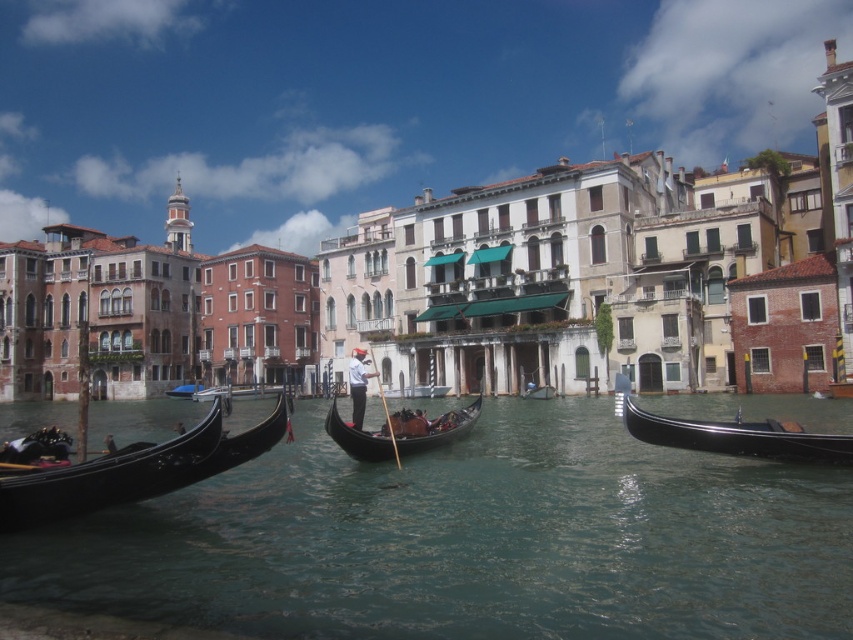
You are standing on the canal bridge and want to take a photo of the shiny black gondola at right. The camera you have can focus on objects within 100 feet. Will the gondola be in focus?

The shiny black gondola at right is 138.74 feet away from the camera, which is beyond the 100 feet focus range. Therefore, the gondola will not be in focus.

You are a tourist planning to take a gondola ride in Venice. You want to choose the widest gondola available for a more spacious experience. Based on the scene, which gondola between the black polished wood gondola at left and the wooden gondola at center should you choose?

The black polished wood gondola at left might be wider than wooden gondola at center, so it could be the better choice for a wider gondola.

You are standing on a bridge overlooking the canal and see the clear water at center and the blue fabric boat at center. Which one appears higher from your viewpoint?

The clear water at center is taller than the blue fabric boat at center, so it appears higher from your viewpoint.